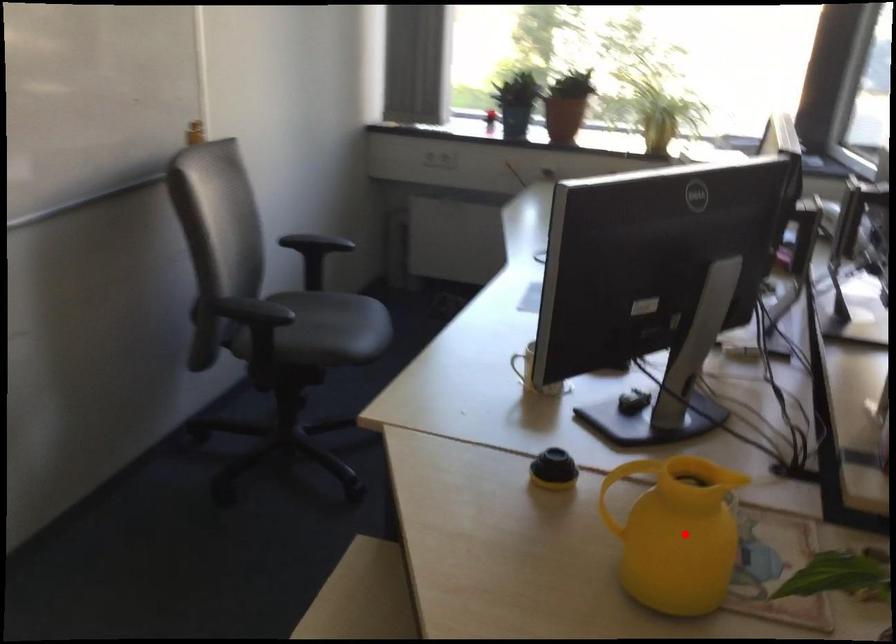
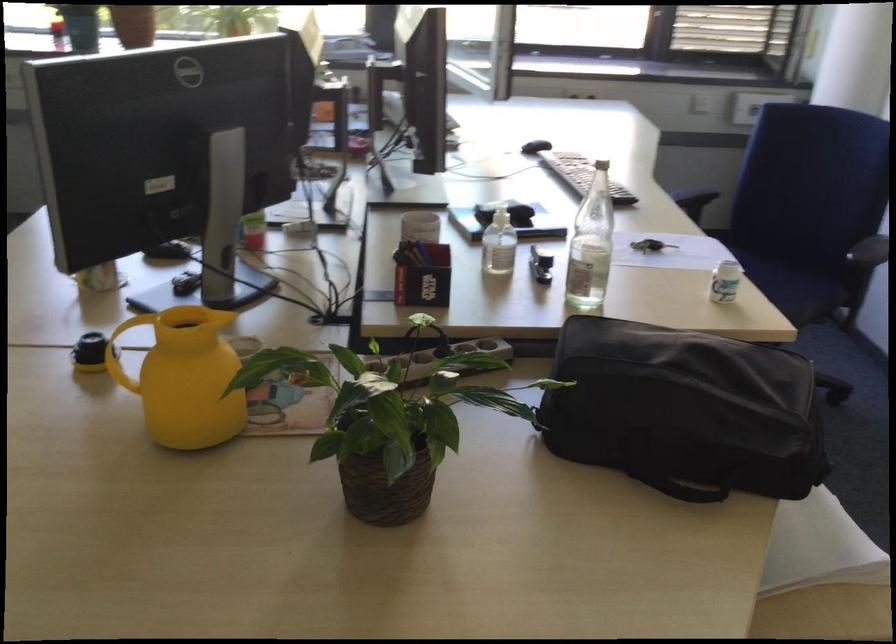
Question: I am providing you with two images of the same scene from different viewpoints. Image1 has a red point marked. In image2, the corresponding 3D location appears at what relative position? Reply with the corresponding letter.

Choices:
 (A) Closer
 (B) Farther

Answer: (B)